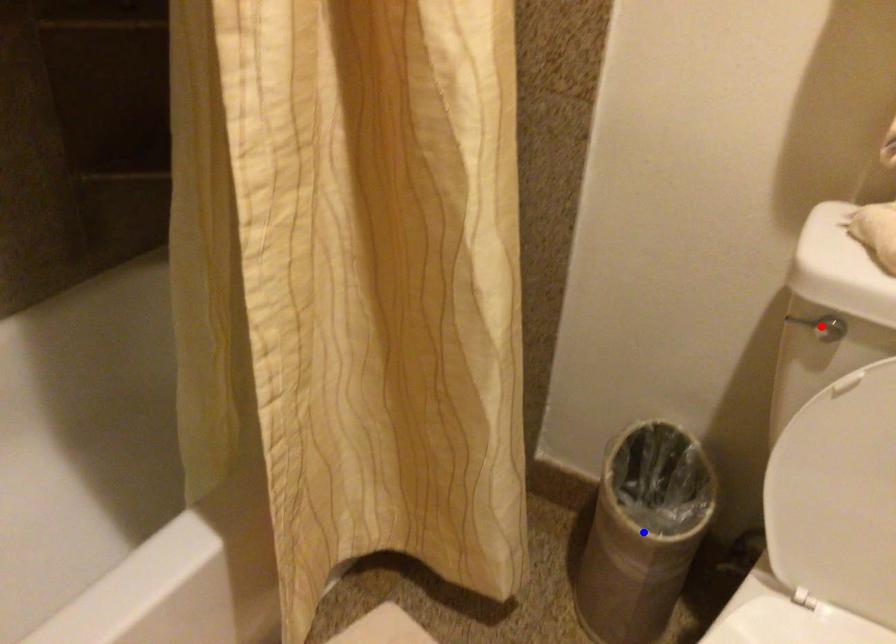
Question: In the image, two points are highlighted. Which point is nearer to the camera? Reply with the corresponding letter.

Choices:
 (A) blue point
 (B) red point

Answer: (B)